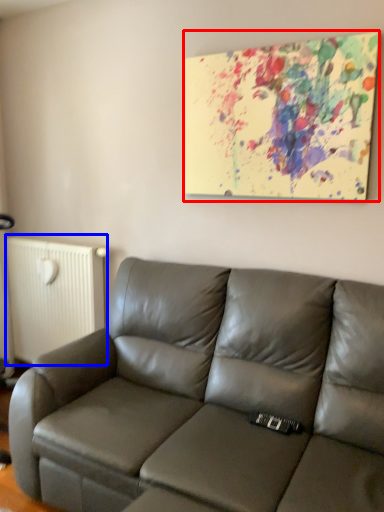
Question: Which of the following is the farthest to the observer, picture frame (highlighted by a red box) or radiator (highlighted by a blue box)?

Choices:
 (A) picture frame
 (B) radiator

Answer: (B)